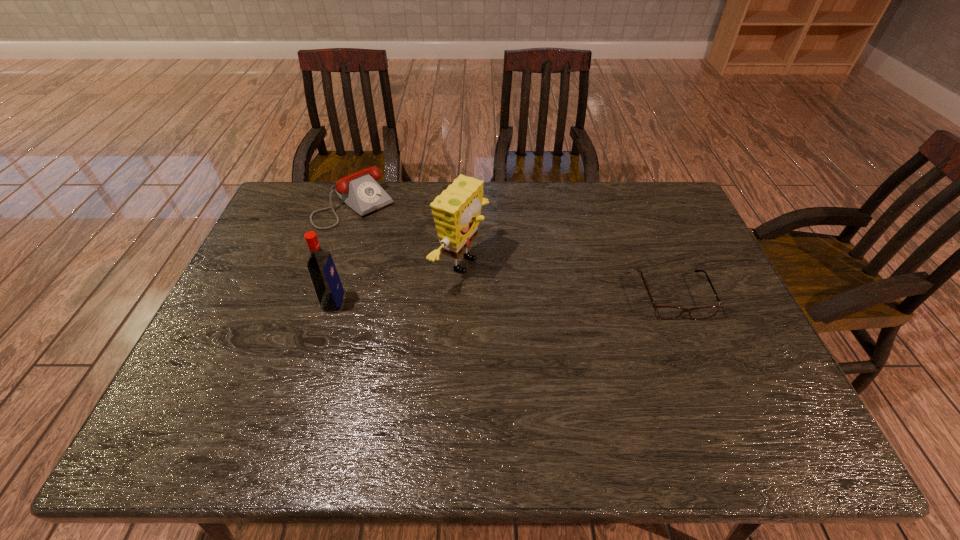
Where is `free space located on the front-facing side of the sponge`? The image size is (960, 540). free space located on the front-facing side of the sponge is located at coordinates (533, 298).

Find the location of a particular element. Image resolution: width=960 pixels, height=540 pixels. vacant region located 0.260m on the front-facing side of the sponge is located at coordinates (570, 312).

The width and height of the screenshot is (960, 540). I want to click on free space located 0.170m on the front-facing side of the sponge, so click(x=540, y=300).

Where is `free space located 0.220m on the dial of the farthest object`? The image size is (960, 540). free space located 0.220m on the dial of the farthest object is located at coordinates (412, 260).

You are a GUI agent. You are given a task and a screenshot of the screen. Output one action in this format:
    pyautogui.click(x=<x>, y=<y>)
    Task: Click on the free space located 0.170m on the dial of the farthest object
    The image size is (960, 540).
    Given the screenshot: What is the action you would take?
    pyautogui.click(x=403, y=251)

This screenshot has width=960, height=540. In order to click on free space located on the dial of the farthest object in this screenshot , I will do `click(425, 272)`.

The image size is (960, 540). Find the location of `object located at the far edge`. object located at the far edge is located at coordinates (360, 191).

I want to click on object positioned at the left edge, so click(x=360, y=191).

You are a GUI agent. You are given a task and a screenshot of the screen. Output one action in this format:
    pyautogui.click(x=<x>, y=<y>)
    Task: Click on the object at the right edge
    
    Given the screenshot: What is the action you would take?
    pyautogui.click(x=662, y=312)

Where is `object that is positioned at the far left corner`? Image resolution: width=960 pixels, height=540 pixels. object that is positioned at the far left corner is located at coordinates (360, 191).